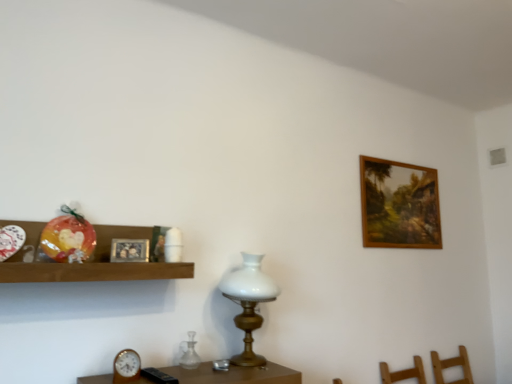
Identify the location of empty space that is ontop of wooden framed painting at upper right, positioned as the second picture frame in front-to-back order (from a real-world perspective). (400, 160).